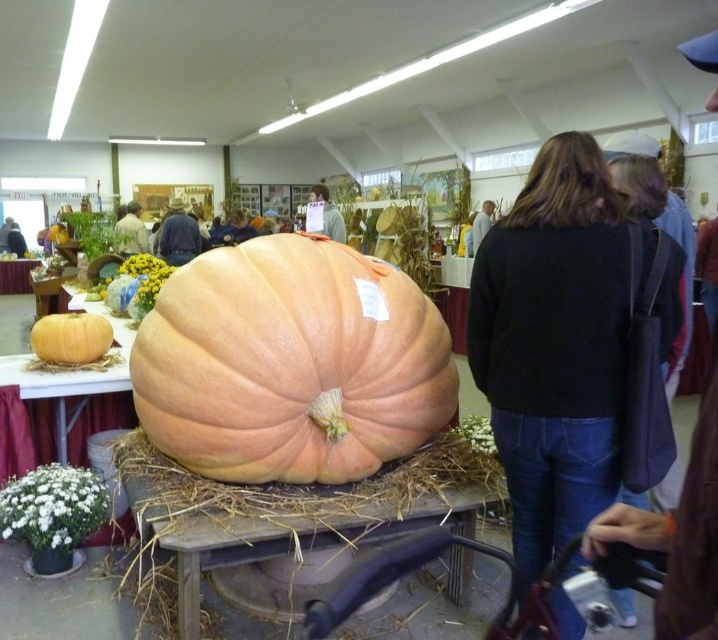
Question: Among these points, which one is nearest to the camera?

Choices:
 (A) (1, 228)
 (B) (597, 177)
 (C) (342, 225)

Answer: (B)

Question: Does black fabric bag at center appear under light brown fabric jacket at center?

Choices:
 (A) no
 (B) yes

Answer: (B)

Question: Which point is closer to the camera?

Choices:
 (A) (192, 253)
 (B) (488, 499)

Answer: (B)

Question: Can you confirm if matte orange pumpkin at center is positioned to the left of black fabric bag at center?

Choices:
 (A) yes
 (B) no

Answer: (A)

Question: Which of the following is the closest to the observer?

Choices:
 (A) (230, 296)
 (B) (480, 205)
 (C) (139, 228)
 (D) (600, 445)

Answer: (D)

Question: Does light brown fabric shirt at center have a larger size compared to light brown hair at center?

Choices:
 (A) yes
 (B) no

Answer: (B)